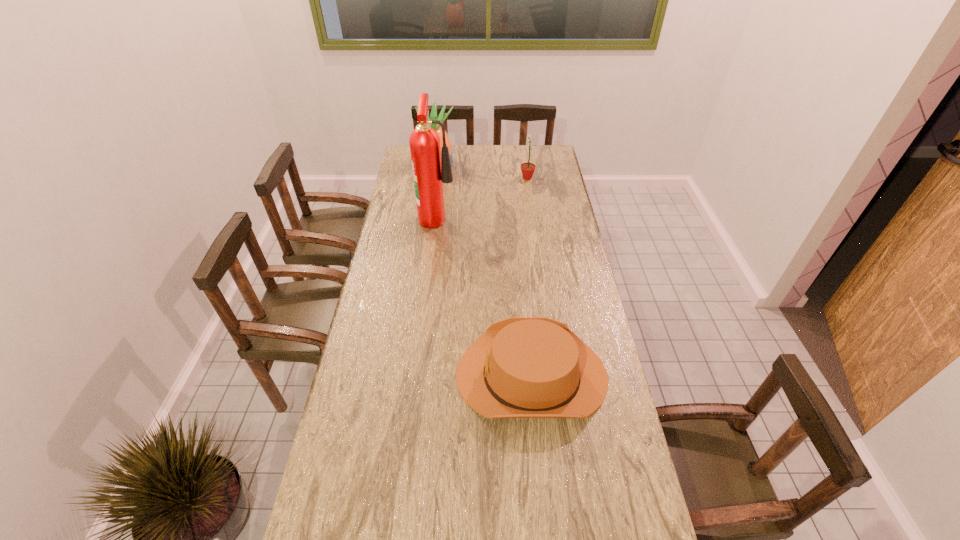
Where is `vacant region at the far edge`? vacant region at the far edge is located at coordinates (483, 152).

Find the location of a particular element. free space at the left edge is located at coordinates (378, 411).

Locate an element on the screen. The width and height of the screenshot is (960, 540). vacant space at the right edge is located at coordinates (557, 240).

Find the location of a particular element. blank area at the far right corner is located at coordinates (552, 157).

You are a GUI agent. You are given a task and a screenshot of the screen. Output one action in this format:
    pyautogui.click(x=<x>, y=<y>)
    Task: Click on the free point between the shortest object and the second shortest object
    
    Given the screenshot: What is the action you would take?
    pyautogui.click(x=529, y=276)

Where is `unoccupied area between the nearest object and the third farthest object`? unoccupied area between the nearest object and the third farthest object is located at coordinates (485, 295).

The width and height of the screenshot is (960, 540). In order to click on empty location between the cowboy hat and the second tallest object in this screenshot , I will do pos(485,270).

You are a GUI agent. You are given a task and a screenshot of the screen. Output one action in this format:
    pyautogui.click(x=<x>, y=<y>)
    Task: Click on the vacant space that's between the second tallest object and the cowboy hat
    
    Given the screenshot: What is the action you would take?
    pyautogui.click(x=485, y=270)

You are a GUI agent. You are given a task and a screenshot of the screen. Output one action in this format:
    pyautogui.click(x=<x>, y=<y>)
    Task: Click on the vacant area that lies between the third tallest object and the third farthest object
    The width and height of the screenshot is (960, 540).
    Given the screenshot: What is the action you would take?
    pyautogui.click(x=482, y=197)

You are a GUI agent. You are given a task and a screenshot of the screen. Output one action in this format:
    pyautogui.click(x=<x>, y=<y>)
    Task: Click on the free point between the sunflower and the tallest object
    This screenshot has width=960, height=540.
    Given the screenshot: What is the action you would take?
    [482, 197]